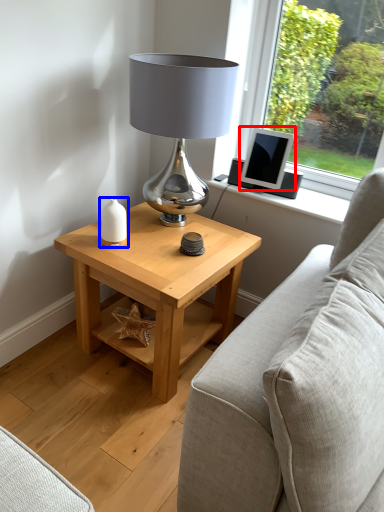
Question: Which point is further to the camera, computer monitor (highlighted by a red box) or candle holder (highlighted by a blue box)?

Choices:
 (A) computer monitor
 (B) candle holder

Answer: (A)